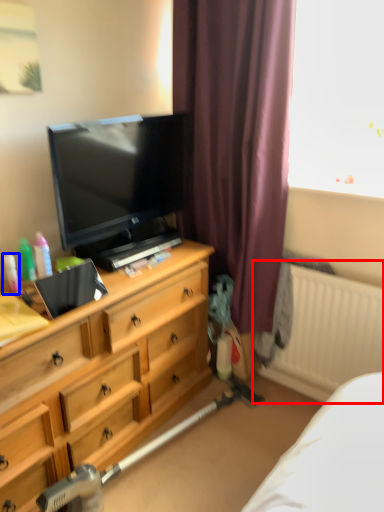
Question: Which point is further to the camera, radiator (highlighted by a red box) or toiletry (highlighted by a blue box)?

Choices:
 (A) radiator
 (B) toiletry

Answer: (A)